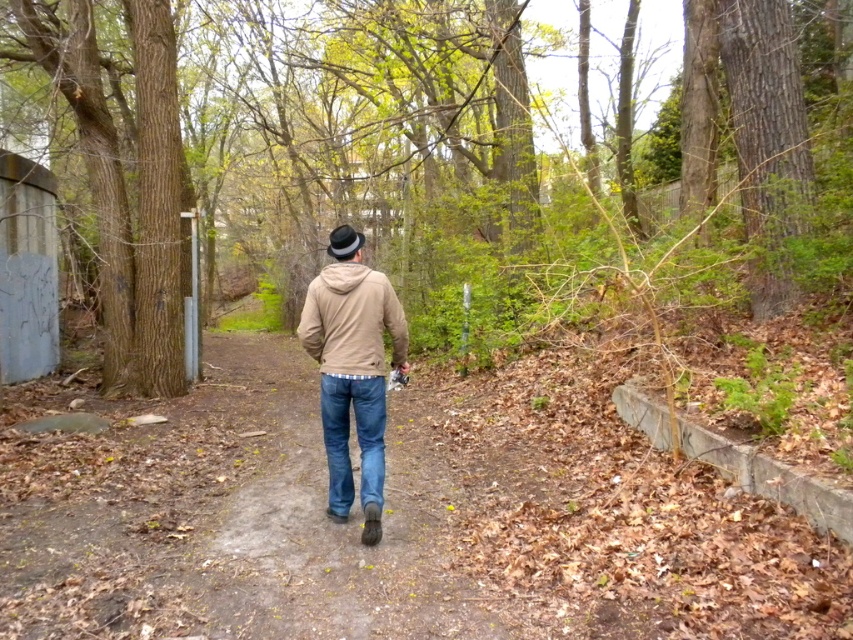
Can you confirm if matte brown jacket at center is wider than denim jeans at center?

Yes.

Who is more distant from viewer, (335, 317) or (335, 394)?

Positioned behind is point (335, 394).

Between point (373, 349) and point (372, 401), which one is positioned behind?

Point (372, 401)

Where is `matte brown jacket at center`? matte brown jacket at center is located at coordinates coord(352,371).

Which of these two, matte beige jacket at center or denim jeans at center, stands shorter?

matte beige jacket at center is shorter.

Is matte beige jacket at center smaller than denim jeans at center?

Yes.

Where is `matte beige jacket at center`? This screenshot has width=853, height=640. matte beige jacket at center is located at coordinates (351, 321).

Is matte brown jacket at center shorter than matte beige jacket at center?

In fact, matte brown jacket at center may be taller than matte beige jacket at center.

Who is positioned more to the right, matte brown jacket at center or matte beige jacket at center?

From the viewer's perspective, matte beige jacket at center appears more on the right side.

Image resolution: width=853 pixels, height=640 pixels. Describe the element at coordinates (352, 371) in the screenshot. I see `matte brown jacket at center` at that location.

You are a GUI agent. You are given a task and a screenshot of the screen. Output one action in this format:
    pyautogui.click(x=<x>, y=<y>)
    Task: Click on the matte brown jacket at center
    This screenshot has width=853, height=640.
    Given the screenshot: What is the action you would take?
    (352, 371)